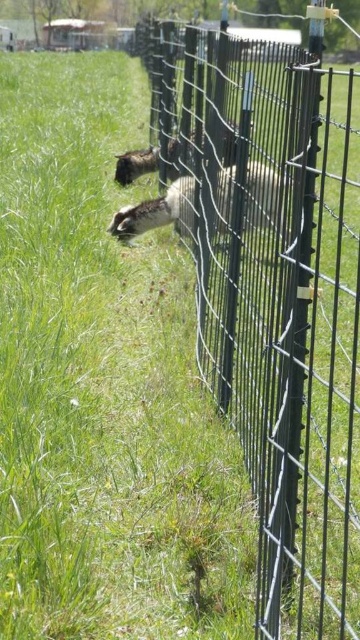
You are a farmer checking the pasture. You see the black wire fence at center and the white woolen sheep at center. Which object is located more to the right side of the image?

The black wire fence at center is more to the right side of the image than the white woolen sheep at center.

You are a farmer checking the pasture. You notice the black wire fence at center and the white woolen sheep at center. Which object takes up more space in the image?

The black wire fence at center is bigger than the white woolen sheep at center, so the black wire fence at center takes up more space in the image.